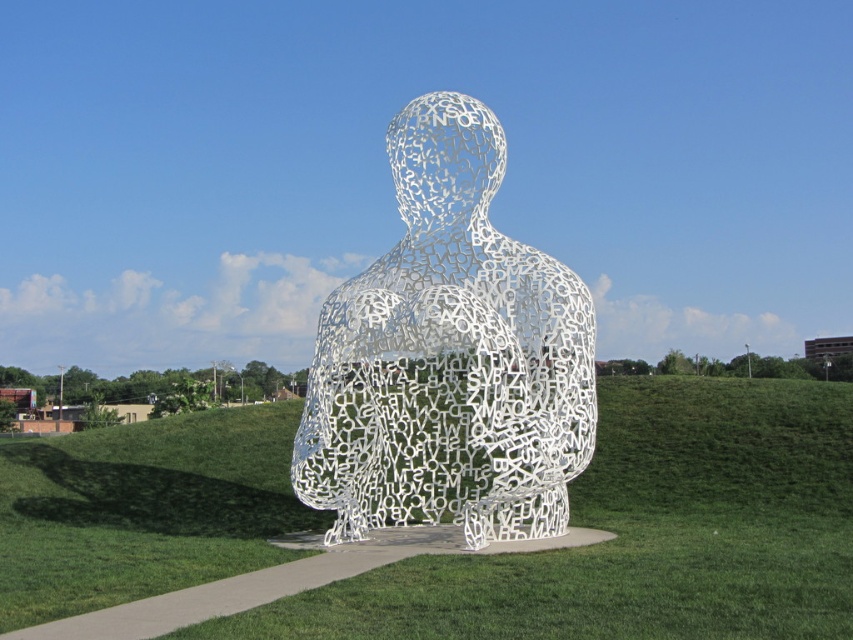
Who is more distant from viewer, (202, 413) or (468, 509)?

Positioned behind is point (202, 413).

Does point (621, 499) lie in front of point (548, 323)?

No, it is behind (548, 323).

Is point (781, 468) closer to camera compared to point (339, 291)?

No, it is not.

Locate an element on the screen. This screenshot has height=640, width=853. green grass at center is located at coordinates (643, 532).